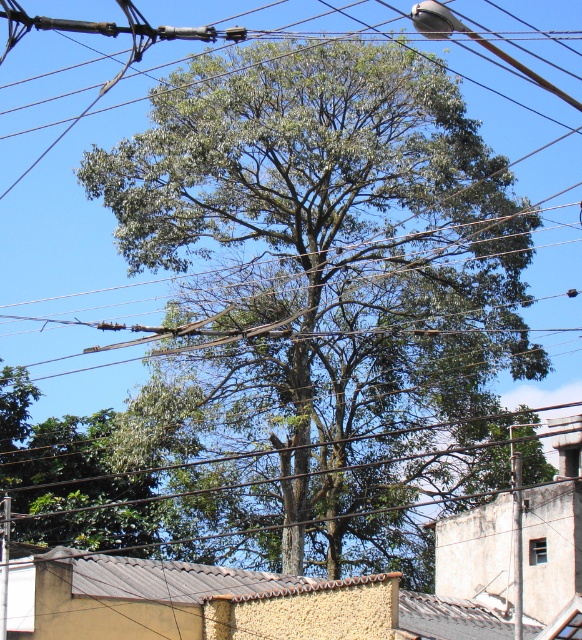
Question: Which point is closer to the camera?

Choices:
 (A) (258, 323)
 (B) (3, 598)

Answer: (B)

Question: Does green leafy tree at center have a larger size compared to metallic gray telegraph pole at center?

Choices:
 (A) yes
 (B) no

Answer: (A)

Question: Which of the following is the closest to the observer?

Choices:
 (A) metallic gray telegraph pole at center
 (B) green leafy tree at center

Answer: (B)

Question: Can you confirm if green leafy tree at center is bigger than metallic gray telegraph pole at center?

Choices:
 (A) yes
 (B) no

Answer: (A)

Question: Is green leafy tree at center to the left of metallic gray telegraph pole at center from the viewer's perspective?

Choices:
 (A) yes
 (B) no

Answer: (B)